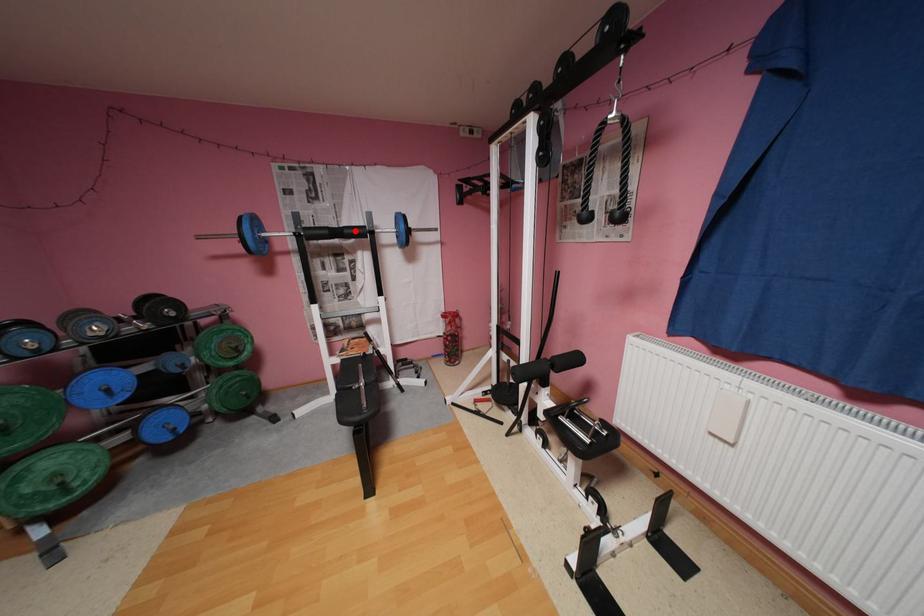
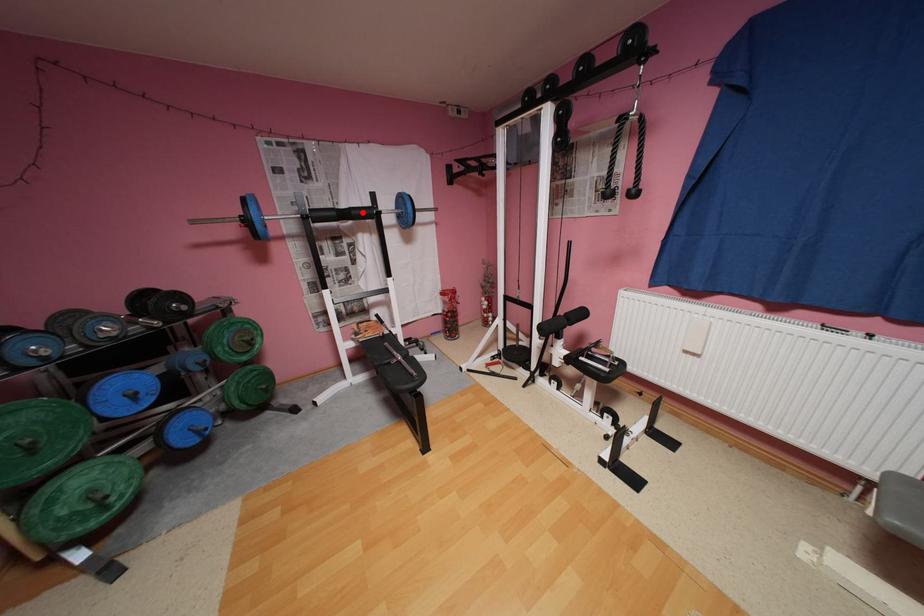
I am providing you with two images of the same scene from different viewpoints. A red point is marked on the first image and another point is marked on the second image. Do the highlighted points in image1 and image2 indicate the same real-world spot?

Yes